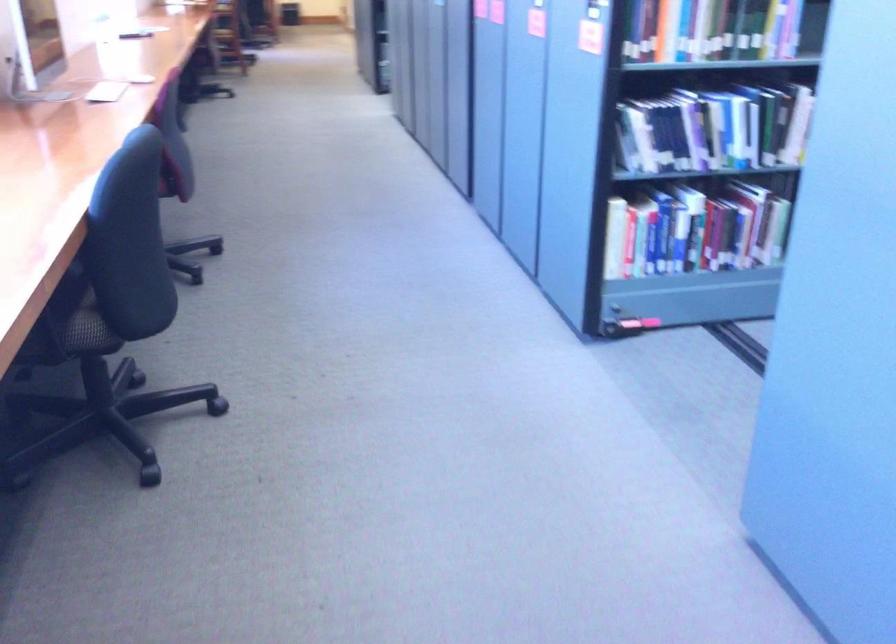
I want to click on shelving crank handle, so click(x=625, y=325).